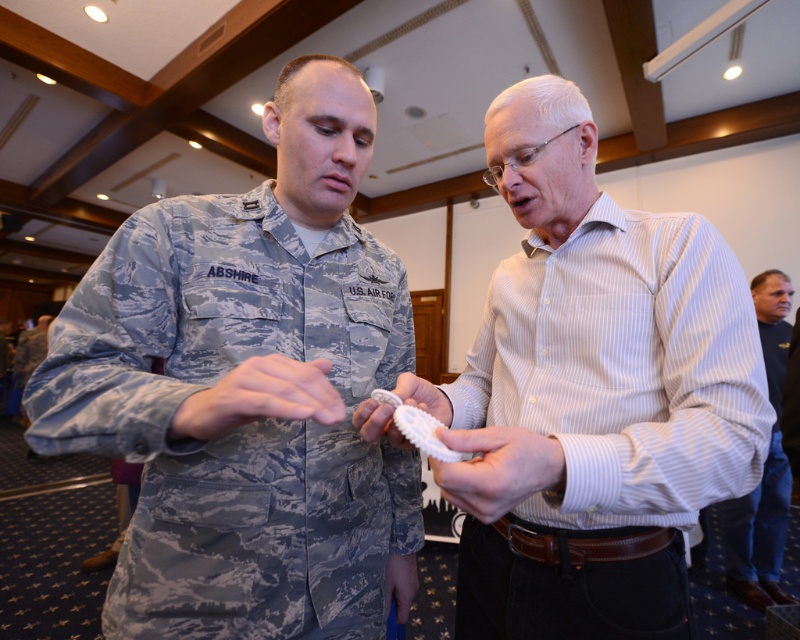
Can you confirm if camouflage uniform at center is positioned to the right of matte blue fabric at lower center?

No, camouflage uniform at center is not to the right of matte blue fabric at lower center.

Between camouflage uniform at center and matte blue fabric at lower center, which one appears on the right side from the viewer's perspective?

matte blue fabric at lower center is more to the right.

Is point (74, 436) less distant than point (404, 554)?

Yes, point (74, 436) is closer to viewer.

You are a GUI agent. You are given a task and a screenshot of the screen. Output one action in this format:
    pyautogui.click(x=<x>, y=<y>)
    Task: Click on the camouflage uniform at center
    
    Given the screenshot: What is the action you would take?
    pyautogui.click(x=248, y=388)

Who is taller, white striped shirt at center or matte blue fabric at lower center?

Standing taller between the two is white striped shirt at center.

Where is `white striped shirt at center`? The width and height of the screenshot is (800, 640). white striped shirt at center is located at coordinates (594, 388).

Locate an element on the screen. This screenshot has width=800, height=640. white striped shirt at center is located at coordinates (594, 388).

Is blue jeans at lower right behind matte blue fabric at lower center?

Yes, it is behind matte blue fabric at lower center.

Who is higher up, blue jeans at lower right or matte blue fabric at lower center?

matte blue fabric at lower center

Is point (730, 579) farther from camera compared to point (410, 554)?

That is True.

Locate an element on the screen. blue jeans at lower right is located at coordinates (764, 467).